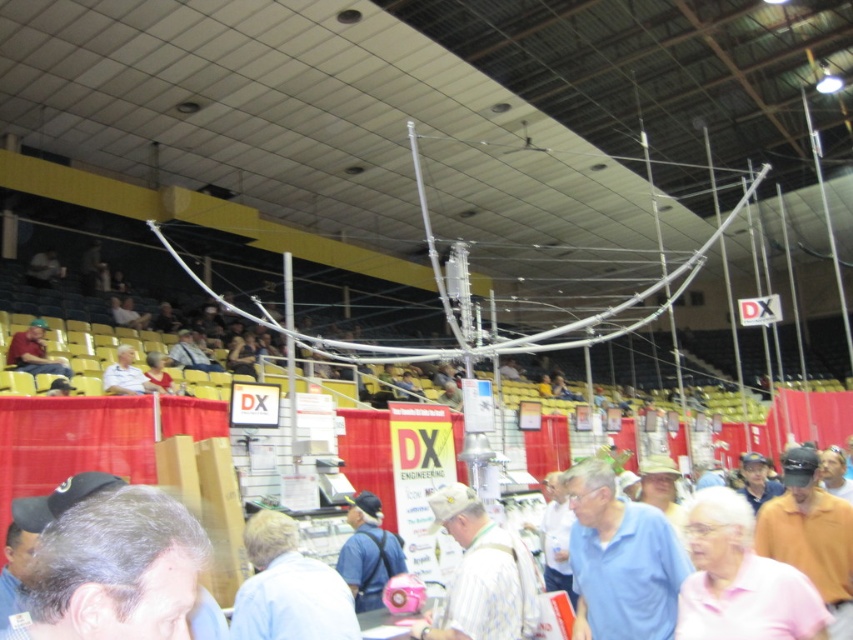
Who is more distant from viewer, (636, 500) or (282, 618)?

Point (636, 500)

Is blue cotton shirt at center positioned before light blue shirt at center?

No.

Is point (573, 472) behind point (248, 589)?

Yes, it is behind point (248, 589).

The width and height of the screenshot is (853, 640). I want to click on blue cotton shirt at center, so click(x=619, y=560).

Based on the photo, who is higher up, tan fabric cap at center or matte red shirt at left?

Positioned higher is matte red shirt at left.

Does tan fabric cap at center have a greater width compared to matte red shirt at left?

Incorrect, tan fabric cap at center's width does not surpass matte red shirt at left's.

Does point (494, 545) come closer to viewer compared to point (32, 371)?

Yes, it is in front of point (32, 371).

Find the location of a particular element. Image resolution: width=853 pixels, height=640 pixels. tan fabric cap at center is located at coordinates (482, 573).

Does tan fabric cap at center appear under blue fabric shirt at center?

No, tan fabric cap at center is not below blue fabric shirt at center.

Who is higher up, tan fabric cap at center or blue fabric shirt at center?

tan fabric cap at center is above.

Between point (473, 632) and point (357, 570), which one is positioned in front?

Point (473, 632) is more forward.

You are a GUI agent. You are given a task and a screenshot of the screen. Output one action in this format:
    pyautogui.click(x=<x>, y=<y>)
    Task: Click on the tan fabric cap at center
    The image size is (853, 640).
    Given the screenshot: What is the action you would take?
    pyautogui.click(x=482, y=573)